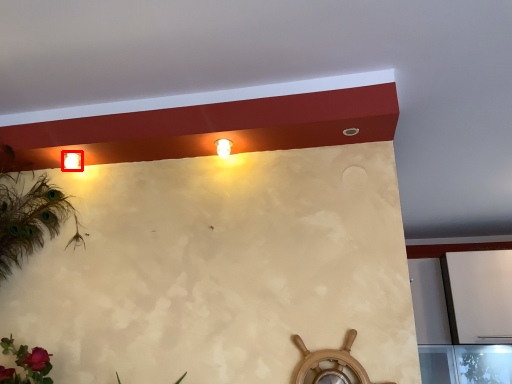
Question: Where is lamp (annotated by the red box) located in relation to fixture in the image?

Choices:
 (A) left
 (B) right

Answer: (A)